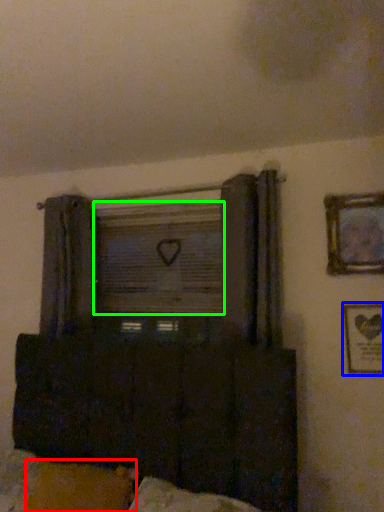
Question: Which is farther away from pillow (highlighted by a red box)? picture frame (highlighted by a blue box) or window screen (highlighted by a green box)?

Choices:
 (A) picture frame
 (B) window screen

Answer: (A)